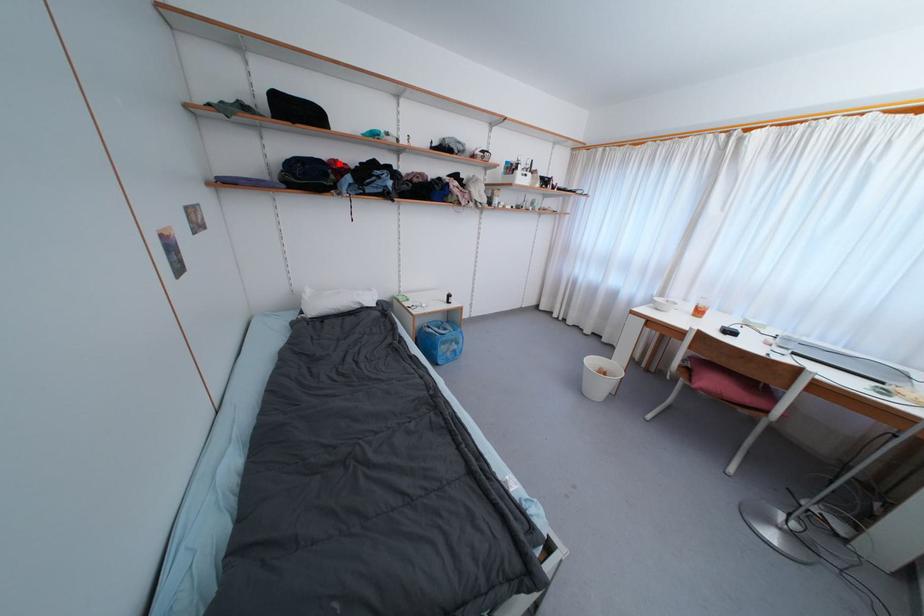
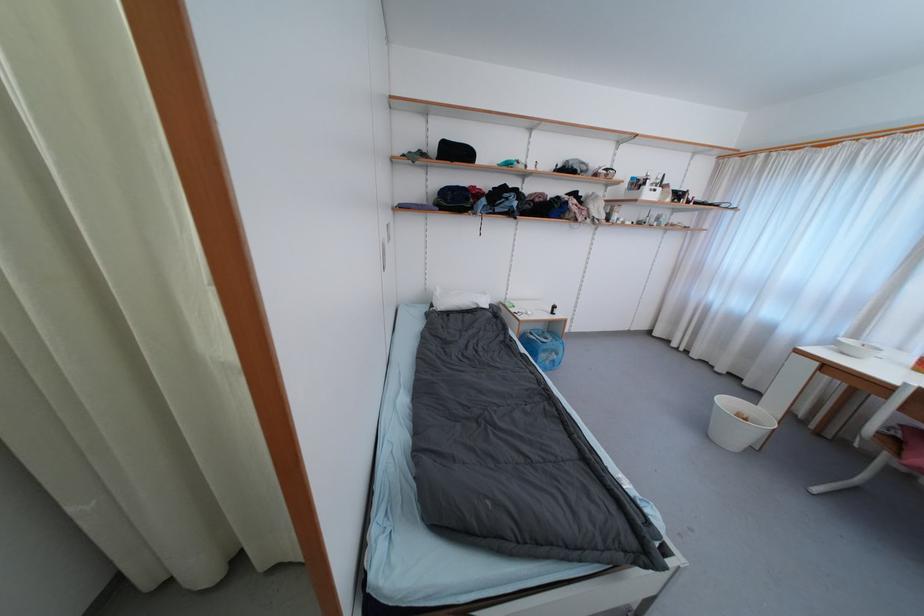
Locate, in the second image, the point that corresponds to the highlighted location in the first image.

(478, 190)